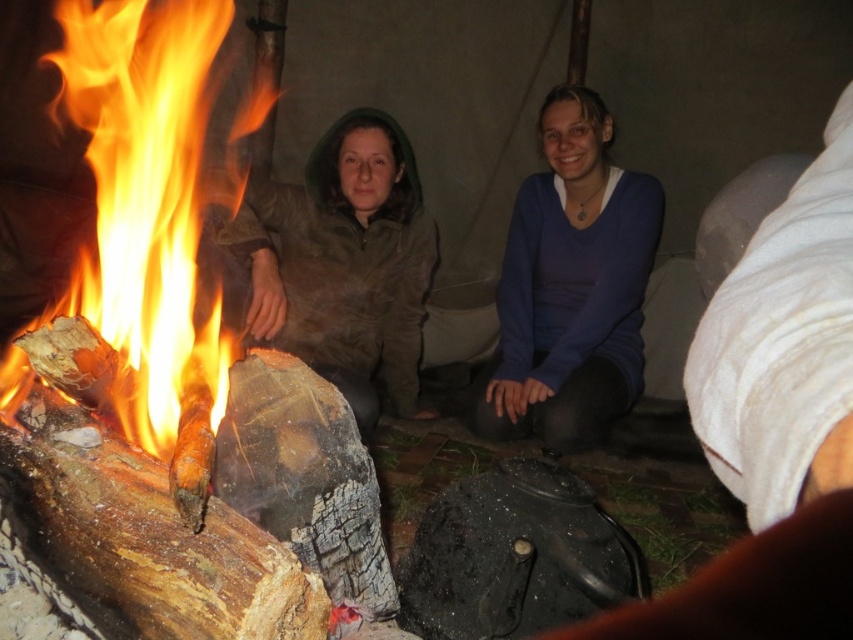
Question: Can you confirm if charcoal wood fire at left is positioned above green matte jacket at center?

Choices:
 (A) no
 (B) yes

Answer: (B)

Question: Can you confirm if charcoal wood fire at left is positioned above blue sweater at center?

Choices:
 (A) no
 (B) yes

Answer: (B)

Question: Does matte brown jacket at center appear on the right side of blue sweater at center?

Choices:
 (A) no
 (B) yes

Answer: (A)

Question: Which point is closer to the camera?

Choices:
 (A) (566, 346)
 (B) (149, 147)
 (C) (347, 291)

Answer: (B)

Question: Which is nearer to the matte brown jacket at center?

Choices:
 (A) blue sweater at center
 (B) green matte jacket at center
 (C) charcoal wood fire at left

Answer: (A)

Question: Which point is closer to the camera?

Choices:
 (A) matte brown jacket at center
 (B) green matte jacket at center
 (C) blue sweater at center
 (D) charcoal wood fire at left

Answer: (D)